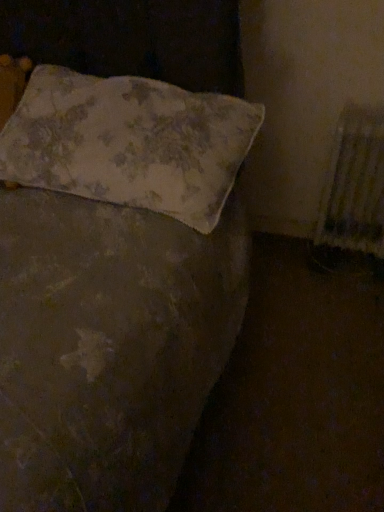
Question: Are white textured radiator at right and floral fabric pillow at upper left located far from each other?

Choices:
 (A) yes
 (B) no

Answer: (B)

Question: From the image's perspective, would you say white textured radiator at right is shown under floral fabric pillow at upper left?

Choices:
 (A) yes
 (B) no

Answer: (A)

Question: From a real-world perspective, is white textured radiator at right located higher than floral fabric pillow at upper left?

Choices:
 (A) no
 (B) yes

Answer: (A)

Question: Is the surface of white textured radiator at right in direct contact with floral fabric pillow at upper left?

Choices:
 (A) no
 (B) yes

Answer: (A)

Question: Does white textured radiator at right contain floral fabric pillow at upper left?

Choices:
 (A) yes
 (B) no

Answer: (B)

Question: Is white textured radiator at right at the left side of floral fabric pillow at upper left?

Choices:
 (A) no
 (B) yes

Answer: (A)

Question: Can you confirm if floral fabric pillow at upper left is positioned to the right of white textured radiator at right?

Choices:
 (A) yes
 (B) no

Answer: (B)

Question: Is floral fabric pillow at upper left located outside white textured radiator at right?

Choices:
 (A) no
 (B) yes

Answer: (B)

Question: From a real-world perspective, is floral fabric pillow at upper left physically above white textured radiator at right?

Choices:
 (A) no
 (B) yes

Answer: (B)

Question: Does floral fabric pillow at upper left touch white textured radiator at right?

Choices:
 (A) no
 (B) yes

Answer: (A)

Question: Considering the relative sizes of floral fabric pillow at upper left and white textured radiator at right in the image provided, is floral fabric pillow at upper left smaller than white textured radiator at right?

Choices:
 (A) no
 (B) yes

Answer: (A)

Question: Is floral fabric pillow at upper left in front of white textured radiator at right?

Choices:
 (A) no
 (B) yes

Answer: (B)

Question: In the image, is floral fabric pillow at upper left on the left side or the right side of white textured radiator at right?

Choices:
 (A) right
 (B) left

Answer: (B)